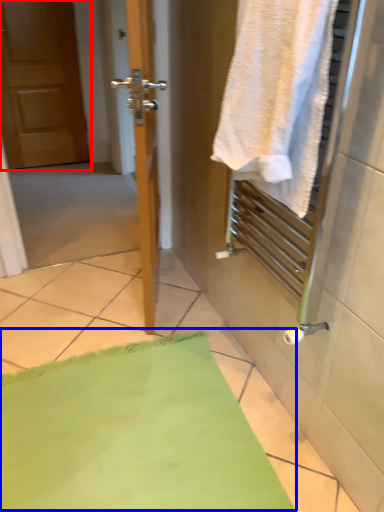
Question: Which object appears closest to the camera in this image, door (highlighted by a red box) or bath mat (highlighted by a blue box)?

Choices:
 (A) door
 (B) bath mat

Answer: (B)